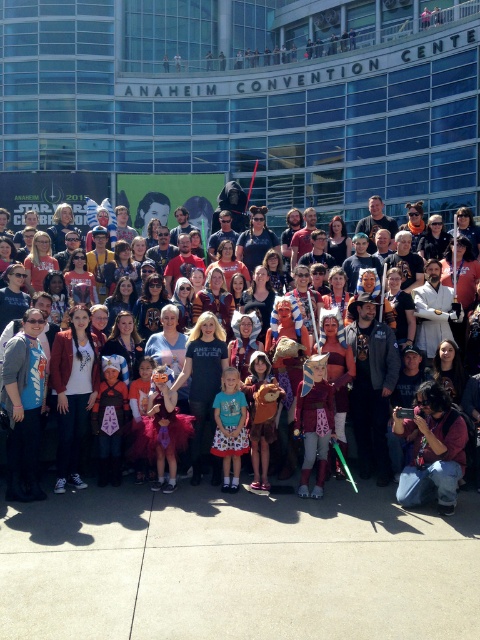
Question: Which is farther from the matte pink dress at center?

Choices:
 (A) matte blue shirt at center
 (B) multicolored costumes at center

Answer: (B)

Question: Estimate the real-world distances between objects in this image. Which object is closer to the matte blue shirt at center?

Choices:
 (A) matte pink dress at center
 (B) multicolored costumes at center

Answer: (A)

Question: Does matte pink dress at center have a greater width compared to matte blue shirt at center?

Choices:
 (A) yes
 (B) no

Answer: (A)

Question: Which point is farther to the camera?

Choices:
 (A) matte blue shirt at center
 (B) multicolored costumes at center
 (C) matte pink dress at center

Answer: (C)

Question: Is matte pink dress at center below matte blue shirt at center?

Choices:
 (A) no
 (B) yes

Answer: (B)

Question: Considering the relative positions of matte pink dress at center and matte blue shirt at center in the image provided, where is matte pink dress at center located with respect to matte blue shirt at center?

Choices:
 (A) below
 (B) above

Answer: (A)